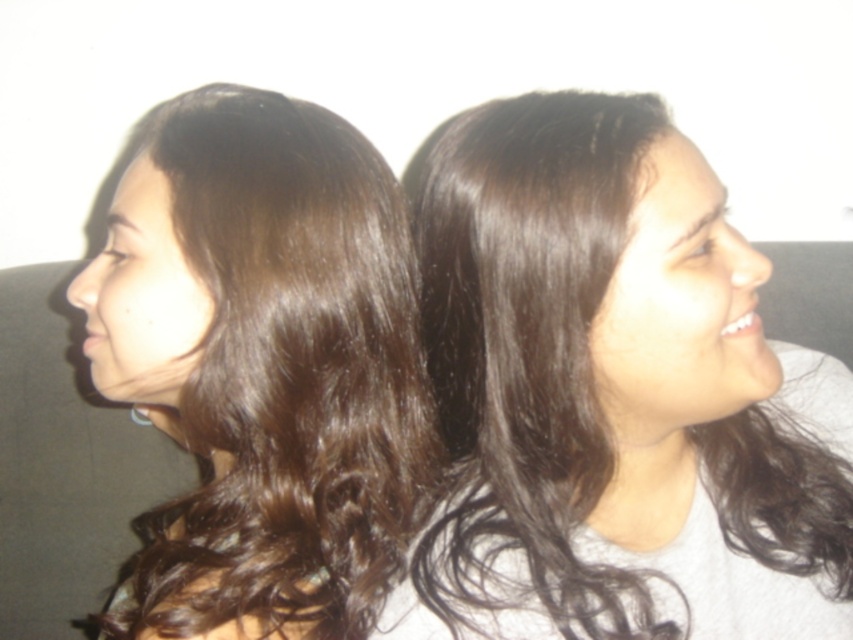
Measure the distance between dark brown hair at center and camera.

dark brown hair at center and camera are 18.78 inches apart.

Which is below, dark brown hair at center or dark brown hair at left?

Positioned lower is dark brown hair at left.

Which is behind, point (538, 157) or point (236, 234)?

Positioned behind is point (236, 234).

The width and height of the screenshot is (853, 640). I want to click on dark brown hair at center, so click(x=614, y=396).